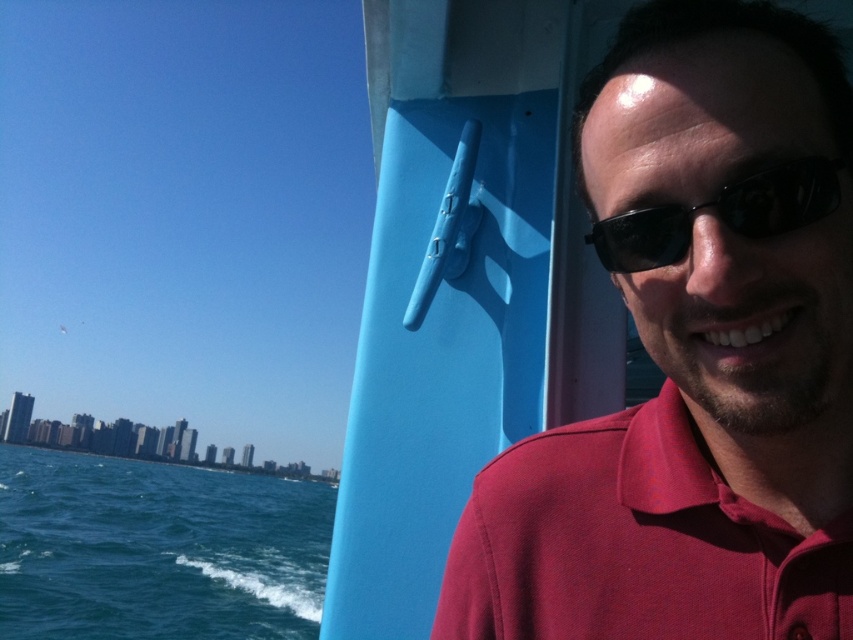
Question: In this image, where is matte red shirt at right located relative to blue liquid water at lower left?

Choices:
 (A) right
 (B) left

Answer: (A)

Question: Which object appears closest to the camera in this image?

Choices:
 (A) matte red polo shirt at right
 (B) black matte sunglasses at right

Answer: (B)

Question: Is matte red shirt at right above blue liquid water at lower left?

Choices:
 (A) no
 (B) yes

Answer: (B)

Question: Among these objects, which one is farthest from the camera?

Choices:
 (A) matte red polo shirt at right
 (B) blue liquid water at lower left

Answer: (B)

Question: Which object appears closest to the camera in this image?

Choices:
 (A) blue liquid water at lower left
 (B) matte red polo shirt at right
 (C) matte red shirt at right
 (D) black matte sunglasses at right

Answer: (D)

Question: Can you confirm if matte red polo shirt at right is bigger than black matte sunglasses at right?

Choices:
 (A) yes
 (B) no

Answer: (A)